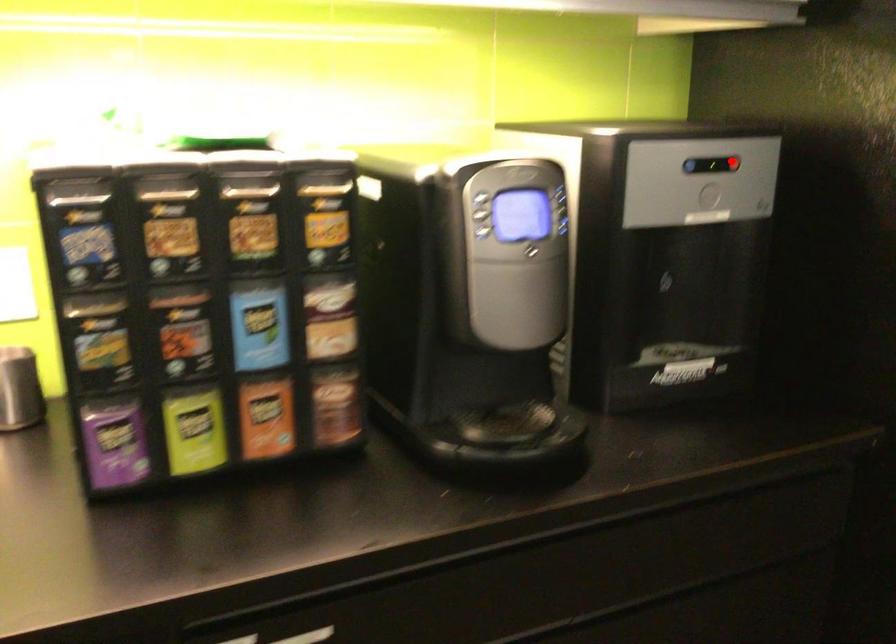
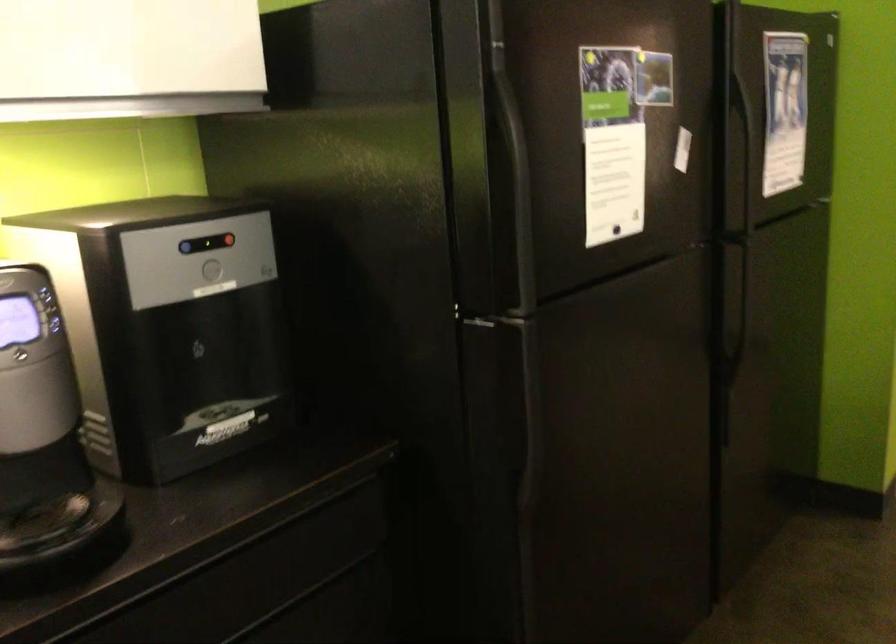
Question: I am providing you with two images of the same scene from different viewpoints. A red point is shown in image1. For the corresponding object point in image2, is it positioned nearer or farther from the camera?

Choices:
 (A) Nearer
 (B) Farther

Answer: (B)